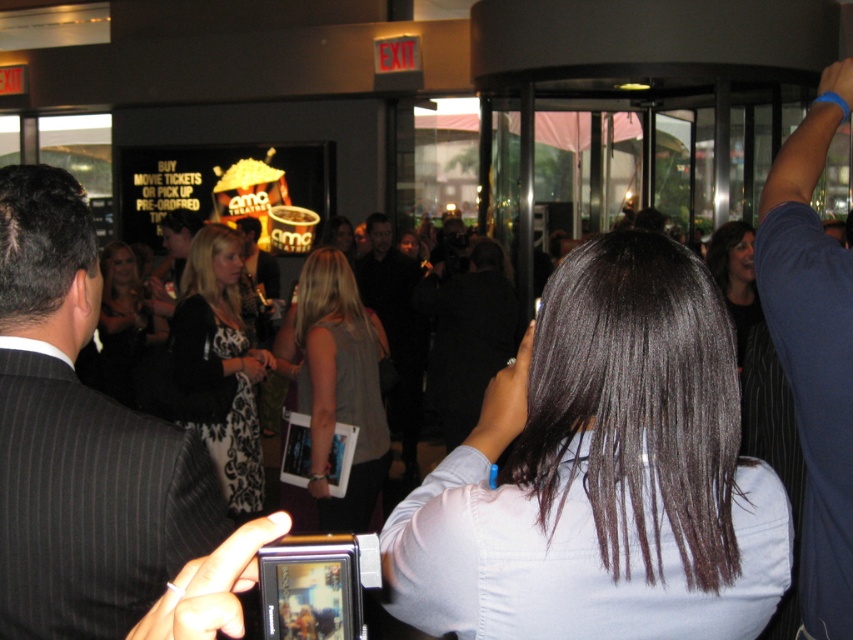
Between dark brown hair at center and black dress at center, which one appears on the left side from the viewer's perspective?

From the viewer's perspective, black dress at center appears more on the left side.

Between dark brown hair at center and black dress at center, which one has more height?

With more height is black dress at center.

This screenshot has height=640, width=853. Find the location of `dark brown hair at center`. dark brown hair at center is located at coordinates (602, 472).

Can you confirm if dark brown hair at center is taller than blue fabric arm at upper right?

No, dark brown hair at center is not taller than blue fabric arm at upper right.

Can you confirm if dark brown hair at center is wider than blue fabric arm at upper right?

Yes, dark brown hair at center is wider than blue fabric arm at upper right.

Between point (709, 289) and point (804, 170), which one is positioned behind?

The point (804, 170) is more distant.

This screenshot has width=853, height=640. Identify the location of dark brown hair at center. (602, 472).

Is dark gray pinstripe suit at left wider than black damask dress at center?

No.

Describe the element at coordinates (79, 440) in the screenshot. I see `dark gray pinstripe suit at left` at that location.

Identify the location of dark gray pinstripe suit at left. (79, 440).